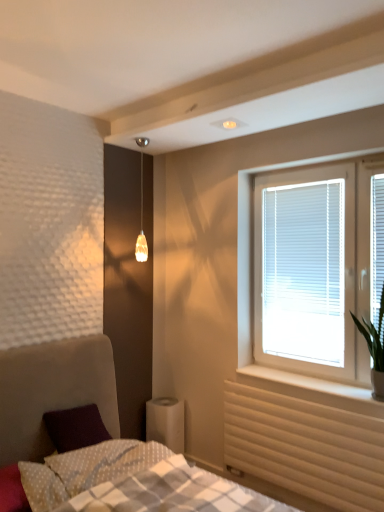
Question: Do you think white wood window sill at lower right is within white plastic blinds at right, placed as the 2th window screen when sorted from left to right, or outside of it?

Choices:
 (A) outside
 (B) inside

Answer: (A)

Question: From the image's perspective, relative to white plastic blinds at right, which is the 2th window screen from back to front, is white wood window sill at lower right above or below?

Choices:
 (A) above
 (B) below

Answer: (B)

Question: Based on their relative distances, which object is farther from the beige textured radiator at lower right?

Choices:
 (A) velvet purple pillow at lower left, which is the 1th pillow in right-to-left order
 (B) white textured bed at lower left
 (C) white plastic blinds at upper right, the second window screen from the front
 (D) white blinds at right
 (E) white wood window sill at lower right

Answer: (A)

Question: Based on their relative distances, which object is nearer to the white plastic blinds at upper right, marked as the first window screen in a left-to-right arrangement?

Choices:
 (A) white textured bed at lower left
 (B) white plastic blinds at right, which appears as the first window screen when viewed from the right
 (C) beige textured radiator at lower right
 (D) white blinds at right
 (E) white wood window sill at lower right

Answer: (D)